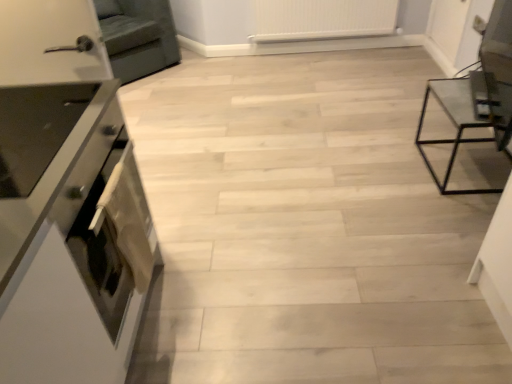
Question: From the image's perspective, is dark gray fabric armchair at upper left above or below transparent glass table at right?

Choices:
 (A) below
 (B) above

Answer: (B)

Question: Considering the relative positions of dark gray fabric armchair at upper left and transparent glass table at right in the image provided, is dark gray fabric armchair at upper left to the left or to the right of transparent glass table at right?

Choices:
 (A) left
 (B) right

Answer: (A)

Question: Based on their relative distances, which object is farther from the transparent glass table at right?

Choices:
 (A) white plastic radiator at upper center
 (B) white glossy oven at left
 (C) dark gray fabric armchair at upper left
 (D) satin silver oven at left

Answer: (C)

Question: Estimate the real-world distances between objects in this image. Which object is closer to the white glossy oven at left?

Choices:
 (A) dark gray fabric armchair at upper left
 (B) satin silver oven at left
 (C) white plastic radiator at upper center
 (D) transparent glass table at right

Answer: (B)